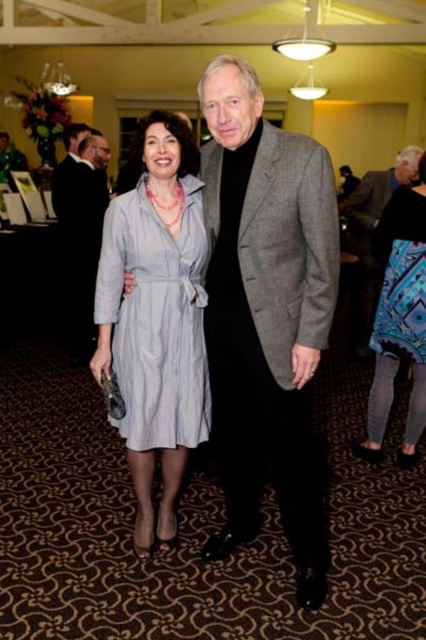
Which is above, blue patterned dress at lower right or black suit at left?

black suit at left is higher up.

Find the location of a particular element. Image resolution: width=426 pixels, height=640 pixels. blue patterned dress at lower right is located at coordinates (399, 317).

From the picture: Which is below, gray wool blazer at center or black suit at left?

gray wool blazer at center is lower down.

Where is `gray wool blazer at center`? The image size is (426, 640). gray wool blazer at center is located at coordinates (265, 310).

This screenshot has width=426, height=640. Find the location of `gray wool blazer at center`. gray wool blazer at center is located at coordinates (265, 310).

Is gray wool blazer at center to the left of blue patterned fabric dress at lower right from the viewer's perspective?

Correct, you'll find gray wool blazer at center to the left of blue patterned fabric dress at lower right.

At what (x,y) coordinates should I click in order to perform the action: click on gray wool blazer at center. Please return your answer as a coordinate pair (x, y). Looking at the image, I should click on (265, 310).